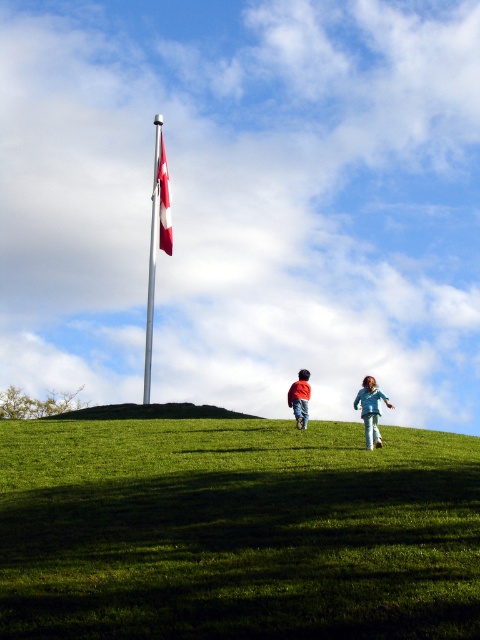
Question: Which object is closer to the camera taking this photo?

Choices:
 (A) green grassy hillside at center
 (B) light blue denim pants at lower right
 (C) green grassy hill at center
 (D) polished metal flag pole at center

Answer: (C)

Question: Considering the relative positions of green grassy hillside at center and light blue denim pants at lower right in the image provided, where is green grassy hillside at center located with respect to light blue denim pants at lower right?

Choices:
 (A) left
 (B) right

Answer: (A)

Question: Does green grassy hillside at center have a greater width compared to red fabric flag at upper center?

Choices:
 (A) no
 (B) yes

Answer: (B)

Question: Does green grassy hillside at center lie in front of light blue denim pants at lower right?

Choices:
 (A) yes
 (B) no

Answer: (B)

Question: Considering the real-world distances, which object is closest to the green grassy hillside at center?

Choices:
 (A) green grassy hill at center
 (B) red fabric flag at upper center

Answer: (B)

Question: Which of the following is the farthest from the observer?

Choices:
 (A) red fabric flag at upper center
 (B) polished metal flag pole at center
 (C) green grassy hillside at center
 (D) green grassy hill at center

Answer: (A)